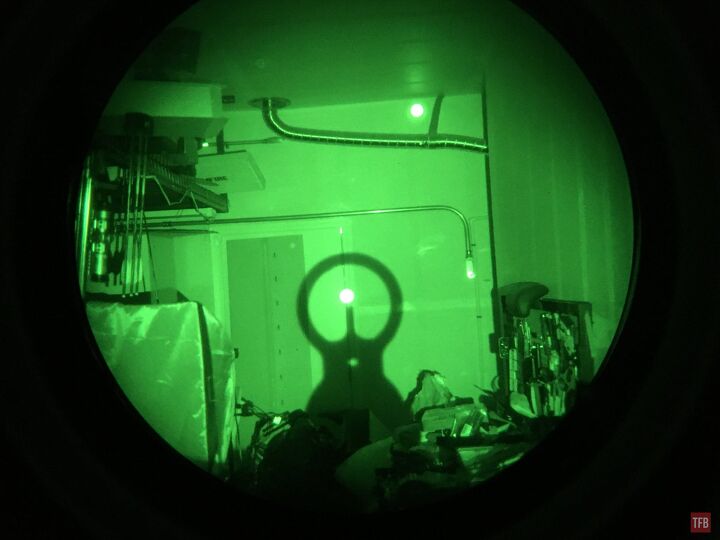
The width and height of the screenshot is (720, 540). I want to click on corner of room, so click(485, 109).